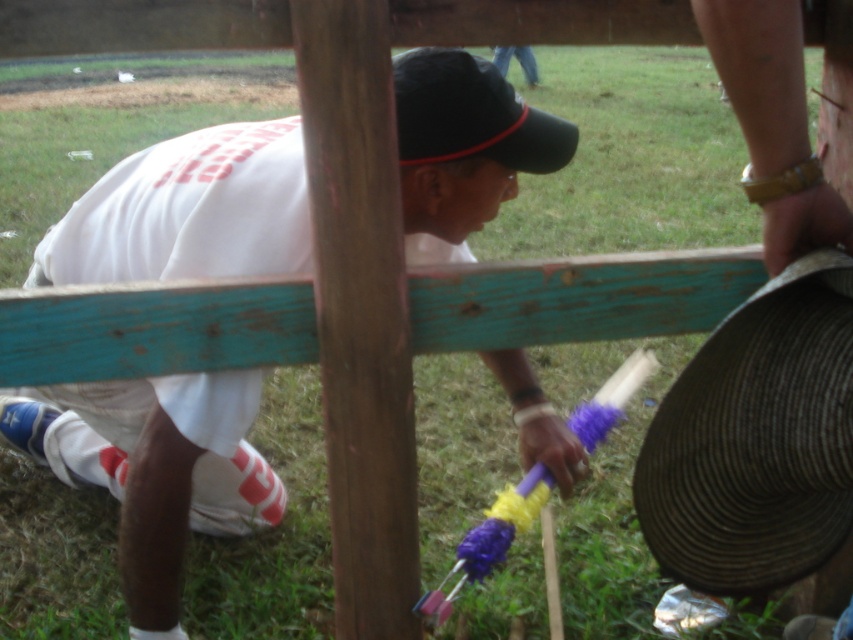
Question: Considering the relative positions of white matte shirt at center and brown wood pole at center in the image provided, where is white matte shirt at center located with respect to brown wood pole at center?

Choices:
 (A) right
 (B) left

Answer: (B)

Question: Estimate the real-world distances between objects in this image. Which object is farther from the brown woven hat at lower right?

Choices:
 (A) black fabric baseball hat at center
 (B) brown wood pole at center
 (C) white matte shirt at center

Answer: (C)

Question: Does brown wood pole at center have a greater width compared to black fabric baseball hat at center?

Choices:
 (A) yes
 (B) no

Answer: (B)

Question: Does brown wood pole at center have a greater width compared to brown woven hat at lower right?

Choices:
 (A) no
 (B) yes

Answer: (A)

Question: Which of these objects is positioned closest to the white matte shirt at center?

Choices:
 (A) brown woven hat at lower right
 (B) black fabric baseball hat at center

Answer: (B)

Question: Which of these objects is positioned farthest from the black fabric baseball hat at center?

Choices:
 (A) brown wood pole at center
 (B) brown woven hat at lower right

Answer: (B)